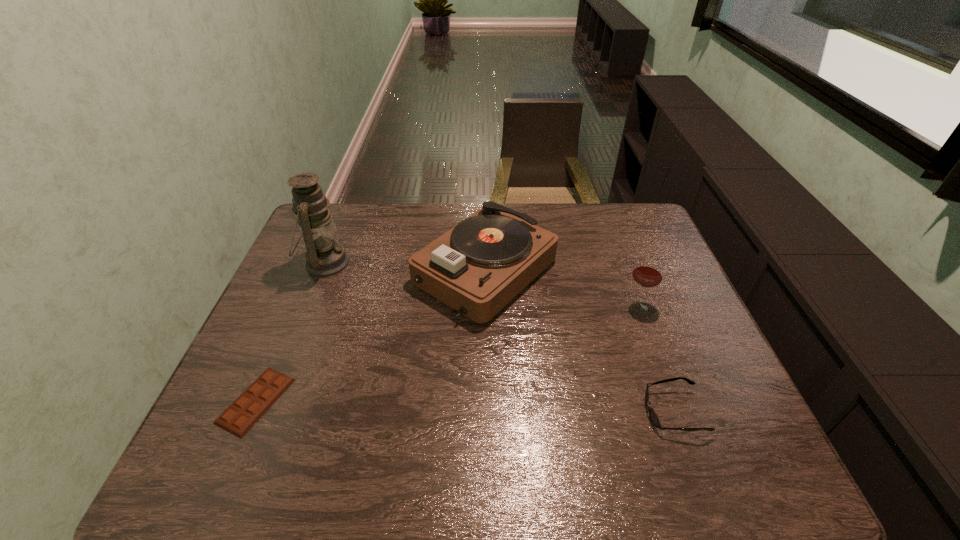
Identify the location of the tallest object. The image size is (960, 540). (325, 258).

In order to click on record player in this screenshot , I will do `click(477, 267)`.

This screenshot has height=540, width=960. I want to click on wineglass, so click(648, 273).

Where is `sunglasses`? This screenshot has width=960, height=540. sunglasses is located at coordinates (653, 416).

Find the location of a particular element. The height and width of the screenshot is (540, 960). the shortest object is located at coordinates (248, 408).

You are a GUI agent. You are given a task and a screenshot of the screen. Output one action in this format:
    pyautogui.click(x=<x>, y=<y>)
    Task: Click on the vacant space located 0.230m on the front of the tallest object
    
    Given the screenshot: What is the action you would take?
    pyautogui.click(x=292, y=348)

Locate an element on the screen. The width and height of the screenshot is (960, 540). vacant space located on the front of the record player is located at coordinates (487, 376).

The width and height of the screenshot is (960, 540). I want to click on vacant space located on the left of the wineglass, so click(588, 305).

This screenshot has width=960, height=540. Find the location of `free location located 0.290m on the lenses of the sunglasses`. free location located 0.290m on the lenses of the sunglasses is located at coordinates (515, 411).

Find the location of a particular element. free location located on the lenses of the sunglasses is located at coordinates (609, 411).